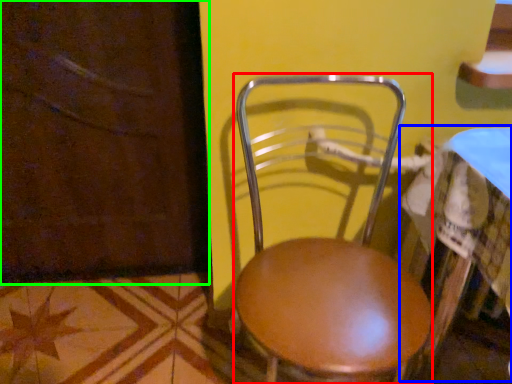
Question: Which object is positioned closest to chair (highlighted by a red box)? Select from table (highlighted by a blue box) and screen door (highlighted by a green box).

Choices:
 (A) table
 (B) screen door

Answer: (A)